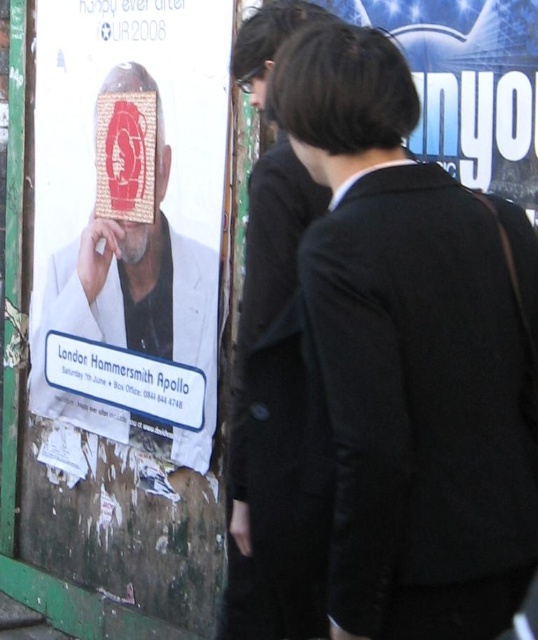
Is black woolen coat at center below matte black suit at center?

Indeed, black woolen coat at center is positioned under matte black suit at center.

Who is more forward, (x=357, y=572) or (x=229, y=602)?

Point (x=357, y=572) is more forward.

At what (x,y) coordinates should I click in order to perform the action: click on black woolen coat at center. Please return your answer as a coordinate pair (x, y). Image resolution: width=538 pixels, height=640 pixels. Looking at the image, I should click on (412, 353).

Can you confirm if black woolen coat at center is positioned below white paper poster at left?

Indeed, black woolen coat at center is positioned under white paper poster at left.

Can you confirm if black woolen coat at center is positioned to the left of white paper poster at left?

In fact, black woolen coat at center is to the right of white paper poster at left.

Does point (429, 372) come behind point (188, 170)?

No, it is in front of (188, 170).

The width and height of the screenshot is (538, 640). Identify the location of black woolen coat at center. (412, 353).

Who is lower down, white paper poster at left or matte black suit at center?

matte black suit at center

Does white paper poster at left come behind matte black suit at center?

Yes, it is behind matte black suit at center.

Where is `white paper poster at left`? The height and width of the screenshot is (640, 538). white paper poster at left is located at coordinates (123, 221).